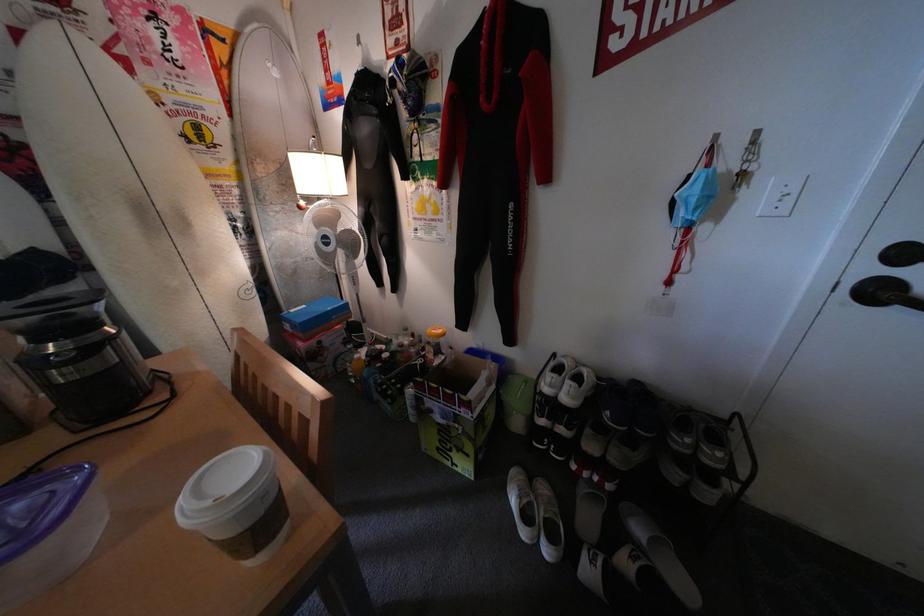
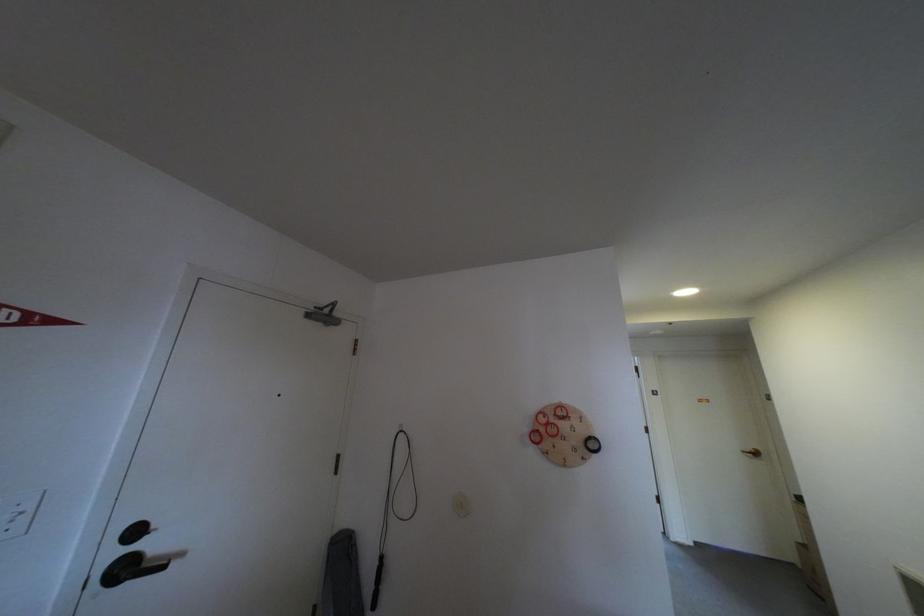
Question: The camera is either moving clockwise (left) or counter-clockwise (right) around the object. The first image is from the beginning of the video and the second image is from the end. Is the camera moving left or right when shooting the video?

Choices:
 (A) Left
 (B) Right

Answer: (A)